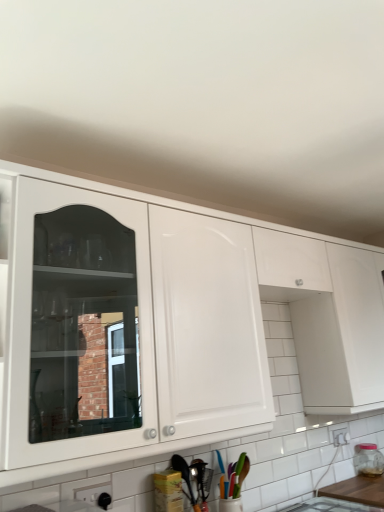
Locate an element on the screen. This screenshot has height=512, width=384. wooden at lower right is located at coordinates tap(357, 490).

At what (x,y) coordinates should I click in order to perform the action: click on white glossy cabinet at upper center. Please return your answer as a coordinate pair (x, y). The height and width of the screenshot is (512, 384). Looking at the image, I should click on (168, 323).

Is transparent glass jar at right at the left side of metallic silver spoon at lower center?

Incorrect, transparent glass jar at right is not on the left side of metallic silver spoon at lower center.

Which of these two, transparent glass jar at right or metallic silver spoon at lower center, is thinner?

With smaller width is metallic silver spoon at lower center.

Between transparent glass jar at right and metallic silver spoon at lower center, which one has less height?

transparent glass jar at right is shorter.

Is transparent glass jar at right far from metallic silver spoon at lower center?

Absolutely, transparent glass jar at right is distant from metallic silver spoon at lower center.

In order to click on counter top on the right of metallic silver spoon at lower center in this screenshot , I will do `click(357, 490)`.

From the image's perspective, is wooden at lower right beneath metallic silver spoon at lower center?

Indeed, from the image's perspective, wooden at lower right is shown beneath metallic silver spoon at lower center.

From a real-world perspective, which object rests below the other?

From a 3D spatial view, wooden at lower right is below.

Consider the image. Considering the sizes of wooden at lower right and metallic silver spoon at lower center in the image, is wooden at lower right bigger or smaller than metallic silver spoon at lower center?

In the image, wooden at lower right appears to be larger than metallic silver spoon at lower center.

Can you tell me how much metallic silver spoon at lower center and transparent glass jar at right differ in facing direction?

They differ by 5.32 degrees in their facing directions.

Is metallic silver spoon at lower center turned away from transparent glass jar at right?

metallic silver spoon at lower center does not have its back to transparent glass jar at right.

Is point (183, 478) farther from camera compared to point (359, 459)?

No.

Are metallic silver spoon at lower center and transparent glass jar at right located far from each other?

metallic silver spoon at lower center is positioned a significant distance from transparent glass jar at right.

Locate an element on the screen. cabinetry located on the left of wooden at lower right is located at coordinates (168, 323).

Based on their positions, is wooden at lower right located to the left or right of white glossy cabinet at upper center?

wooden at lower right is to the right of white glossy cabinet at upper center.

Considering the positions of objects wooden at lower right and white glossy cabinet at upper center in the image provided, who is behind, wooden at lower right or white glossy cabinet at upper center?

wooden at lower right is further from the camera.

Does wooden at lower right have a lesser height compared to transparent glass jar at right?

Correct, wooden at lower right is not as tall as transparent glass jar at right.

Considering the relative sizes of wooden at lower right and transparent glass jar at right in the image provided, is wooden at lower right bigger than transparent glass jar at right?

Correct, wooden at lower right is larger in size than transparent glass jar at right.

Does point (381, 497) come farther from viewer compared to point (364, 463)?

No, it is in front of (364, 463).

Based on the photo, is wooden at lower right thinner than transparent glass jar at right?

In fact, wooden at lower right might be wider than transparent glass jar at right.

Consider the image. From a real-world perspective, is transparent glass jar at right located beneath wooden at lower right?

No, from a real-world perspective, transparent glass jar at right is not beneath wooden at lower right.

Find the location of `bottle behind the wooden at lower right`. bottle behind the wooden at lower right is located at coordinates (368, 459).

Which object is closer to the camera taking this photo, transparent glass jar at right or wooden at lower right?

wooden at lower right is closer to the camera.

From a real-world perspective, which object rests below the other?

In real-world perspective, transparent glass jar at right is lower.

Is transparent glass jar at right at the left side of white glossy cabinet at upper center?

Incorrect, transparent glass jar at right is not on the left side of white glossy cabinet at upper center.

Does transparent glass jar at right have a smaller size compared to white glossy cabinet at upper center?

Yes, transparent glass jar at right is smaller than white glossy cabinet at upper center.

Which point is more forward, (363,450) or (173,412)?

The point (173,412) is closer to the camera.

Locate an element on the screen. This screenshot has height=512, width=384. cutlery lying above the transparent glass jar at right (from the image's perspective) is located at coordinates (194, 480).

Where is `cutlery to the left of wooden at lower right`? cutlery to the left of wooden at lower right is located at coordinates (194, 480).

Looking at the image, which one is located further to wooden at lower right, transparent glass jar at right or white glossy cabinet at upper center?

white glossy cabinet at upper center is positioned further to the anchor wooden at lower right.

From the image, which object appears to be farther from wooden at lower right, metallic silver spoon at lower center or transparent glass jar at right?

Based on the image, metallic silver spoon at lower center appears to be further to wooden at lower right.

Based on their spatial positions, is metallic silver spoon at lower center or wooden at lower right further from transparent glass jar at right?

The object further to transparent glass jar at right is metallic silver spoon at lower center.

Considering their positions, is wooden at lower right positioned closer to white glossy cabinet at upper center than metallic silver spoon at lower center?

metallic silver spoon at lower center.

When comparing their distances from transparent glass jar at right, does metallic silver spoon at lower center or white glossy cabinet at upper center seem closer?

metallic silver spoon at lower center lies closer to transparent glass jar at right than the other object.

Considering their positions, is metallic silver spoon at lower center positioned closer to white glossy cabinet at upper center than transparent glass jar at right?

Based on the image, metallic silver spoon at lower center appears to be nearer to white glossy cabinet at upper center.

Looking at this image, considering their positions, is transparent glass jar at right positioned closer to white glossy cabinet at upper center than metallic silver spoon at lower center?

metallic silver spoon at lower center is positioned closer to the anchor white glossy cabinet at upper center.

When comparing their distances from transparent glass jar at right, does white glossy cabinet at upper center or wooden at lower right seem closer?

wooden at lower right lies closer to transparent glass jar at right than the other object.

Find the location of a particular element. The width and height of the screenshot is (384, 512). cutlery between white glossy cabinet at upper center and wooden at lower right from top to bottom is located at coordinates (194, 480).

This screenshot has width=384, height=512. In order to click on cutlery between white glossy cabinet at upper center and transparent glass jar at right in the horizontal direction in this screenshot , I will do `click(194, 480)`.

Identify the location of counter top situated between metallic silver spoon at lower center and transparent glass jar at right from left to right. (357, 490).

The height and width of the screenshot is (512, 384). Identify the location of counter top between white glossy cabinet at upper center and transparent glass jar at right from front to back. (357, 490).